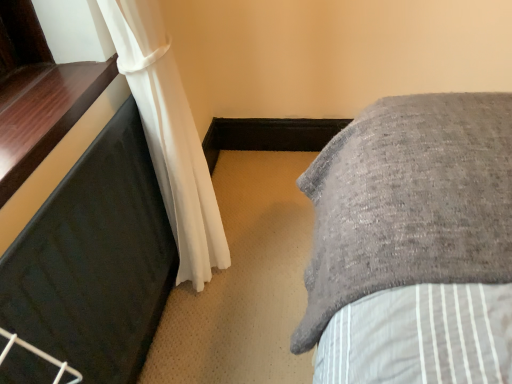
Locate an element on the screen. Image resolution: width=512 pixels, height=384 pixels. white sheer curtain at left is located at coordinates (169, 136).

You are a GUI agent. You are given a task and a screenshot of the screen. Output one action in this format:
    pyautogui.click(x=<x>, y=<y>)
    Task: Click on the white sheer curtain at left
    This screenshot has height=384, width=512.
    Given the screenshot: What is the action you would take?
    pyautogui.click(x=169, y=136)

Is black rubber mat at left in front of or behind white sheer curtain at left in the image?

black rubber mat at left is positioned closer to the viewer than white sheer curtain at left.

Is black rubber mat at left located outside white sheer curtain at left?

No, black rubber mat at left is inside white sheer curtain at left's boundary.

From the image's perspective, which is above, black rubber mat at left or white sheer curtain at left?

white sheer curtain at left appears higher in the image.

Between black rubber mat at left and white sheer curtain at left, which one has smaller width?

black rubber mat at left.

How much distance is there between white sheer curtain at left and black glossy window sill at left?

A distance of 10.01 inches exists between white sheer curtain at left and black glossy window sill at left.

Can you confirm if white sheer curtain at left is smaller than black glossy window sill at left?

No, white sheer curtain at left is not smaller than black glossy window sill at left.

Is white sheer curtain at left facing towards black glossy window sill at left?

No, white sheer curtain at left is not facing towards black glossy window sill at left.

Is white sheer curtain at left completely or partially outside of black glossy window sill at left?

Yes, white sheer curtain at left is not within black glossy window sill at left.

Considering the positions of objects black rubber mat at left and black glossy window sill at left in the image provided, who is more to the left, black rubber mat at left or black glossy window sill at left?

Positioned to the left is black glossy window sill at left.

What's the angular difference between black rubber mat at left and black glossy window sill at left's facing directions?

The facing directions of black rubber mat at left and black glossy window sill at left are 0.892 degrees apart.

Does black rubber mat at left lie behind black glossy window sill at left?

No, black rubber mat at left is in front of black glossy window sill at left.

Is black glossy window sill at left at the back of black rubber mat at left?

Absolutely, black rubber mat at left is directed away from black glossy window sill at left.

Choose the correct answer: Is black glossy window sill at left inside white sheer curtain at left or outside it?

black glossy window sill at left is spatially situated outside white sheer curtain at left.

Does point (44, 106) appear closer or farther from the camera than point (156, 147)?

Point (44, 106) is positioned closer to the camera compared to point (156, 147).

Does black glossy window sill at left touch white sheer curtain at left?

black glossy window sill at left and white sheer curtain at left are clearly separated.

Which is more to the left, black glossy window sill at left or black rubber mat at left?

black glossy window sill at left.

Looking at this image, is black glossy window sill at left far from black rubber mat at left?

No, black glossy window sill at left is not far away from black rubber mat at left.

Is black glossy window sill at left thinner than black rubber mat at left?

In fact, black glossy window sill at left might be wider than black rubber mat at left.

Which is more distant, (7,89) or (114,307)?

Positioned behind is point (114,307).

From the image's perspective, is white sheer curtain at left positioned above or below black rubber mat at left?

Based on their image positions, white sheer curtain at left is located above black rubber mat at left.

Between white sheer curtain at left and black rubber mat at left, which one appears on the right side from the viewer's perspective?

Positioned to the right is white sheer curtain at left.

Would you consider white sheer curtain at left to be distant from black rubber mat at left?

white sheer curtain at left is near black rubber mat at left, not far away.

What are the coordinates of `furniture below the white sheer curtain at left (from a real-world perspective)` in the screenshot? It's located at (95, 260).

Locate an element on the screen. This screenshot has height=384, width=512. window sill above the white sheer curtain at left (from the image's perspective) is located at coordinates (42, 113).

When comparing their distances from black glossy window sill at left, does black rubber mat at left or white sheer curtain at left seem further?

white sheer curtain at left.

Based on their spatial positions, is white sheer curtain at left or black rubber mat at left closer to black glossy window sill at left?

Based on the image, black rubber mat at left appears to be nearer to black glossy window sill at left.

From the image, which object appears to be farther from black rubber mat at left, black glossy window sill at left or white sheer curtain at left?

white sheer curtain at left is further to black rubber mat at left.

Looking at the image, which one is located closer to white sheer curtain at left, black glossy window sill at left or black rubber mat at left?

black rubber mat at left is positioned closer to the anchor white sheer curtain at left.

Based on their spatial positions, is black rubber mat at left or black glossy window sill at left further from white sheer curtain at left?

black glossy window sill at left is further to white sheer curtain at left.

Based on the photo, estimate the real-world distances between objects in this image. Which object is closer to black rubber mat at left, white sheer curtain at left or black glossy window sill at left?

black glossy window sill at left.

This screenshot has height=384, width=512. Identify the location of curtain between black glossy window sill at left and black rubber mat at left from top to bottom. (169, 136).